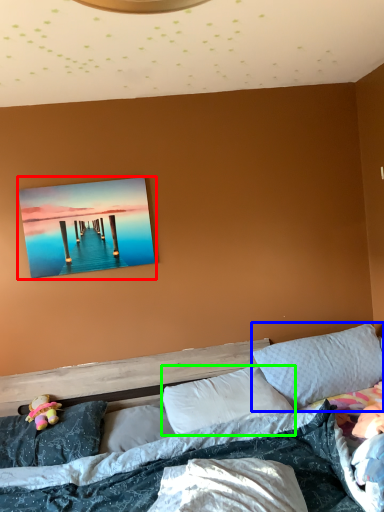
Question: Considering the real-world distances, which object is closest to picture frame (highlighted by a red box)? pillow (highlighted by a blue box) or pillow (highlighted by a green box).

Choices:
 (A) pillow
 (B) pillow

Answer: (B)